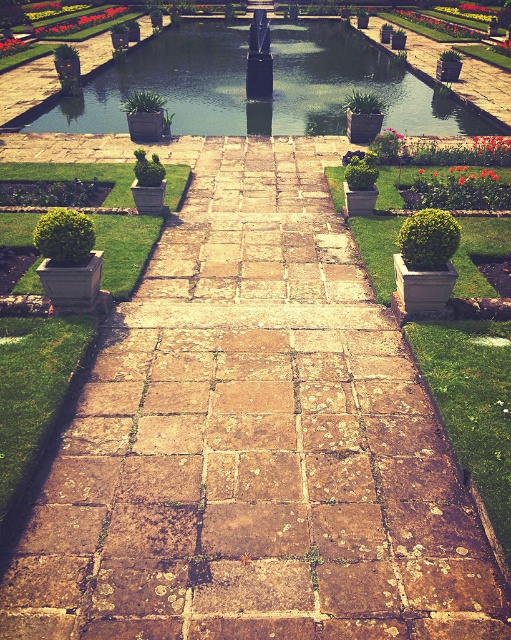
Question: Does green stone waterway at center appear under red glossy tulip at center?

Choices:
 (A) no
 (B) yes

Answer: (A)

Question: Considering the relative positions of green stone waterway at center and green leafy plant at upper left in the image provided, where is green stone waterway at center located with respect to green leafy plant at upper left?

Choices:
 (A) above
 (B) below

Answer: (B)

Question: Which object appears closest to the camera in this image?

Choices:
 (A) green leafy plant at upper left
 (B) vivid red petals at center
 (C) red glossy tulip at center
 (D) green stone waterway at center

Answer: (B)

Question: Which object is positioned closest to the red glossy tulip at center?

Choices:
 (A) green leafy plant at upper left
 (B) green stone waterway at center
 (C) vivid red petals at center

Answer: (A)

Question: Based on their relative distances, which object is nearer to the green leafy plant at upper left?

Choices:
 (A) green stone waterway at center
 (B) vivid red petals at center
 (C) red glossy tulip at center

Answer: (C)

Question: Observing the image, what is the correct spatial positioning of green stone waterway at center in reference to vivid red petals at center?

Choices:
 (A) below
 (B) above

Answer: (B)